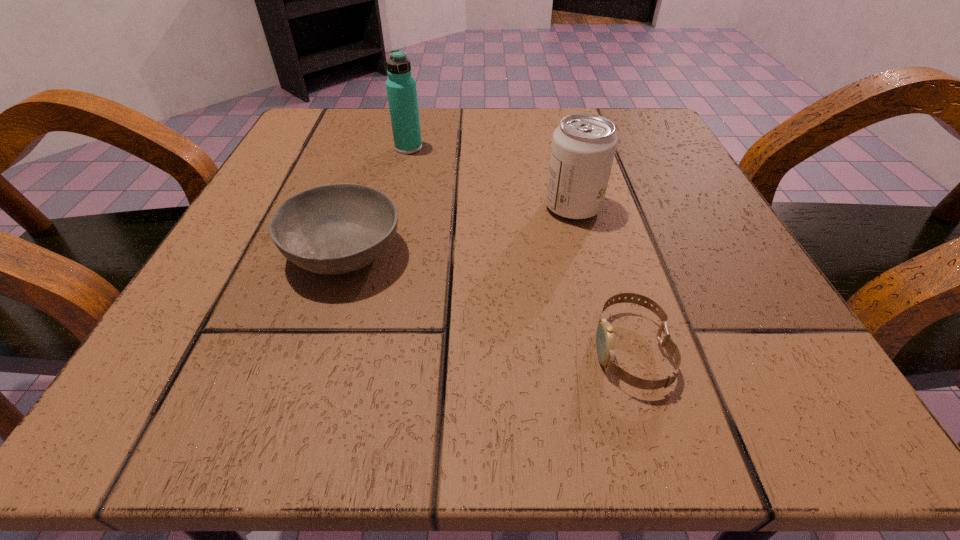
This screenshot has height=540, width=960. I want to click on vacant area situated on the face of the nearest object, so click(x=394, y=350).

In order to click on free space located on the face of the nearest object in this screenshot , I will do `click(332, 350)`.

Find the location of a particular element. The width and height of the screenshot is (960, 540). object that is at the far edge is located at coordinates tap(401, 89).

This screenshot has height=540, width=960. Identify the location of object positioned at the near edge. (605, 342).

Where is `object present at the left edge`? Image resolution: width=960 pixels, height=540 pixels. object present at the left edge is located at coordinates (331, 229).

Find the location of a particular element. object that is at the right edge is located at coordinates (605, 342).

Identify the location of object located at the near right corner. (605, 342).

Where is `vacant space at the far edge of the desktop`? This screenshot has height=540, width=960. vacant space at the far edge of the desktop is located at coordinates (484, 118).

In the image, there is a desktop. What are the coordinates of `vacant space at the left edge` in the screenshot? It's located at (226, 252).

Where is `free space at the right edge of the desktop`? free space at the right edge of the desktop is located at coordinates (668, 271).